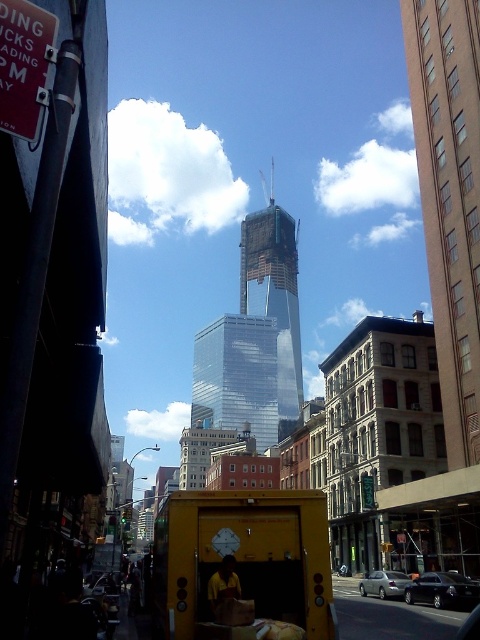
Based on the photo, you are a delivery driver who needs to park your car 200 meters away from the transparent glass skyscraper at center. Is the shiny black sedan at center parked within the required distance?

The distance between the transparent glass skyscraper at center and the shiny black sedan at center is 226.56 meters, which exceeds the 200 meters requirement. Therefore, the shiny black sedan at center is parked beyond the required distance.

You are a pedestrian standing on the sidewalk and see the glassy steel skyscraper at center and the shiny black sedan at center. Which object is positioned more to the right from your viewpoint?

The glassy steel skyscraper at center is to the right of the shiny black sedan at center, so the glassy steel skyscraper at center is positioned more to the right.

You are a delivery driver who needs to park your shiny black sedan at center. There is a transparent glass skyscraper at center in the way. Can you drive around it to reach your parking spot?

The transparent glass skyscraper at center is positioned on the left side of the shiny black sedan at center, so you can drive around it on the right side to reach your parking spot.